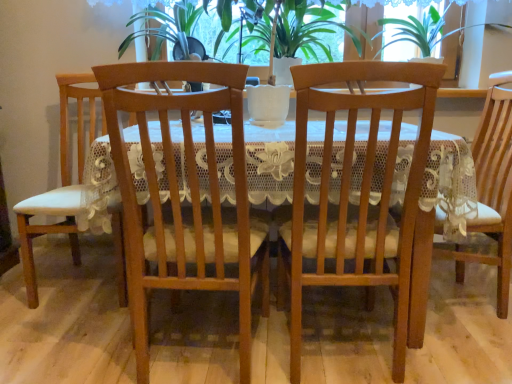
Question: Is wooden table at center next to green leafy plant at center and touching it?

Choices:
 (A) yes
 (B) no

Answer: (B)

Question: Is wooden table at center not near green leafy plant at center?

Choices:
 (A) no
 (B) yes

Answer: (A)

Question: From a real-world perspective, is wooden table at center located higher than green leafy plant at center?

Choices:
 (A) no
 (B) yes

Answer: (A)

Question: Can you confirm if wooden table at center is wider than green leafy plant at center?

Choices:
 (A) yes
 (B) no

Answer: (A)

Question: Is wooden table at center to the left of green leafy plant at center from the viewer's perspective?

Choices:
 (A) yes
 (B) no

Answer: (A)

Question: From the image's perspective, is matte wood chair at center, positioned as the 1th chair in right-to-left order, above or below transparent lace at upper center?

Choices:
 (A) above
 (B) below

Answer: (B)

Question: Is point (496, 163) positioned closer to the camera than point (456, 11)?

Choices:
 (A) closer
 (B) farther

Answer: (A)

Question: In terms of width, does matte wood chair at center, positioned as the 1th chair in right-to-left order, look wider or thinner when compared to transparent lace at upper center?

Choices:
 (A) thin
 (B) wide

Answer: (B)

Question: In the image, is matte wood chair at center, which is the 4th chair in left-to-right order, positioned in front of or behind transparent lace at upper center?

Choices:
 (A) behind
 (B) front

Answer: (B)

Question: Is transparent lace at upper center in front of or behind white leather chair at left, the 4th chair in the right-to-left sequence, in the image?

Choices:
 (A) behind
 (B) front

Answer: (A)

Question: From their relative heights in the image, would you say transparent lace at upper center is taller or shorter than white leather chair at left, the 4th chair in the right-to-left sequence?

Choices:
 (A) tall
 (B) short

Answer: (B)

Question: Which is correct: transparent lace at upper center is inside white leather chair at left, which is counted as the 1th chair, starting from the left, or outside of it?

Choices:
 (A) inside
 (B) outside

Answer: (B)

Question: Is transparent lace at upper center wider or thinner than white leather chair at left, the 4th chair in the right-to-left sequence?

Choices:
 (A) wide
 (B) thin

Answer: (B)

Question: From the image's perspective, is white leather chair at left, which is counted as the 1th chair, starting from the left, located above or below wooden table at center?

Choices:
 (A) below
 (B) above

Answer: (B)

Question: From a real-world perspective, is white leather chair at left, which is counted as the 1th chair, starting from the left, above or below wooden table at center?

Choices:
 (A) above
 (B) below

Answer: (A)